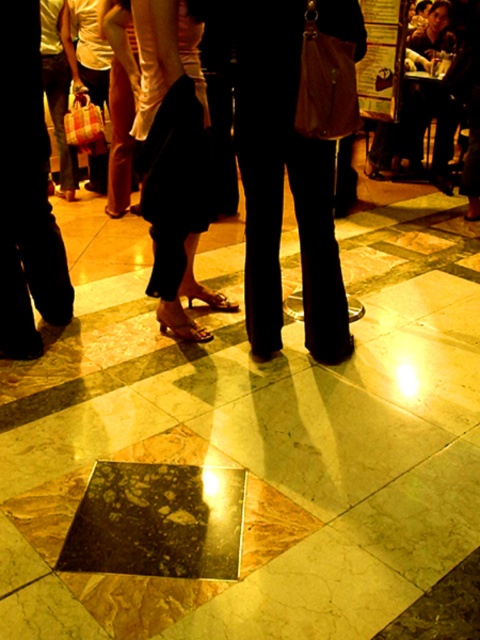
In the scene shown: Who is more forward, (311, 268) or (26, 243)?

Point (311, 268)

Based on the photo, which of these two, dark brown leather pants at center or black leather pants at left, stands taller?

Standing taller between the two is black leather pants at left.

At what (x,y) coordinates should I click in order to perform the action: click on dark brown leather pants at center. Please return your answer as a coordinate pair (x, y). The image size is (480, 640). Looking at the image, I should click on (283, 180).